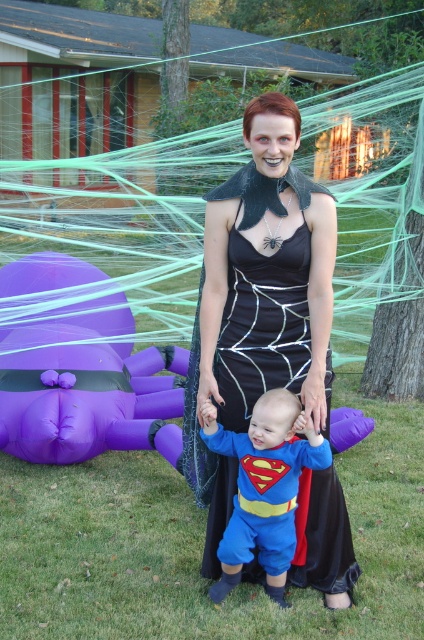
Question: Does black matte dress at center have a greater width compared to blue fabric superman costume at center?

Choices:
 (A) yes
 (B) no

Answer: (A)

Question: Which object is the farthest from the black matte dress at center?

Choices:
 (A) purple inflatable spider at lower left
 (B) blue fabric superman costume at center

Answer: (A)

Question: Can you confirm if black matte dress at center is positioned to the right of purple inflatable spider at lower left?

Choices:
 (A) no
 (B) yes

Answer: (B)

Question: Can you confirm if black matte dress at center is bigger than purple inflatable spider at lower left?

Choices:
 (A) yes
 (B) no

Answer: (B)

Question: Which point is closer to the camera?

Choices:
 (A) purple inflatable spider at lower left
 (B) blue fabric superman costume at center

Answer: (B)

Question: Which is nearer to the purple inflatable spider at lower left?

Choices:
 (A) black matte dress at center
 (B) blue fabric superman costume at center

Answer: (A)